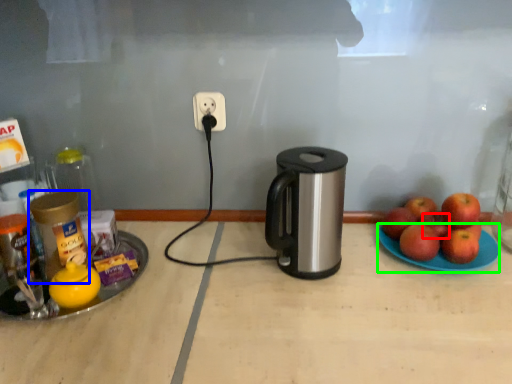
Question: Estimate the real-world distances between objects in this image. Which object is farther from apple (highlighted by a red box), bottle (highlighted by a blue box) or glass plate (highlighted by a green box)?

Choices:
 (A) bottle
 (B) glass plate

Answer: (A)